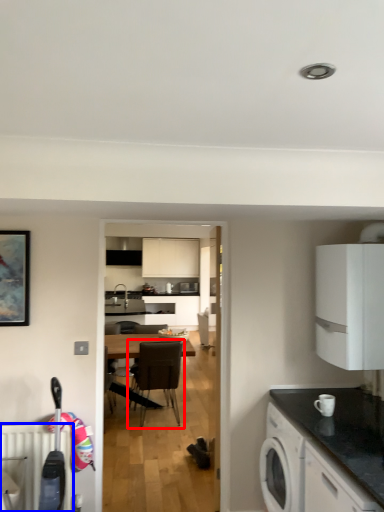
Question: Which object is further to the camera taking this photo, chair (highlighted by a red box) or radiator (highlighted by a blue box)?

Choices:
 (A) chair
 (B) radiator

Answer: (A)